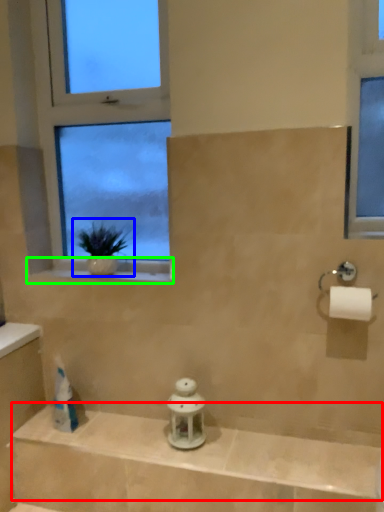
Question: Based on their relative distances, which object is farther from balustrade (highlighted by a red box)? Choose from houseplant (highlighted by a blue box) and window sill (highlighted by a green box).

Choices:
 (A) houseplant
 (B) window sill

Answer: (A)